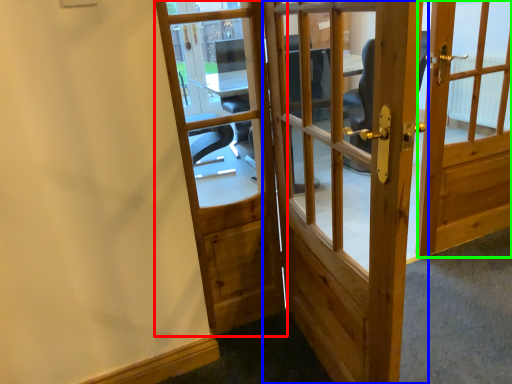
Question: Which object is the farthest from door (highlighted by a red box)? Choose among these: door (highlighted by a blue box) or door (highlighted by a green box).

Choices:
 (A) door
 (B) door

Answer: (B)